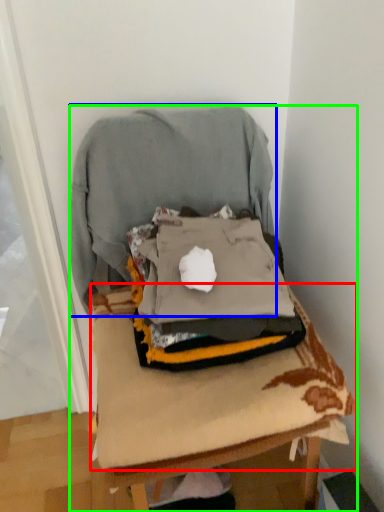
Question: Considering the real-world distances, which object is farthest from sheet (highlighted by a red box)? sweatshirt (highlighted by a blue box) or furniture (highlighted by a green box)?

Choices:
 (A) sweatshirt
 (B) furniture

Answer: (A)